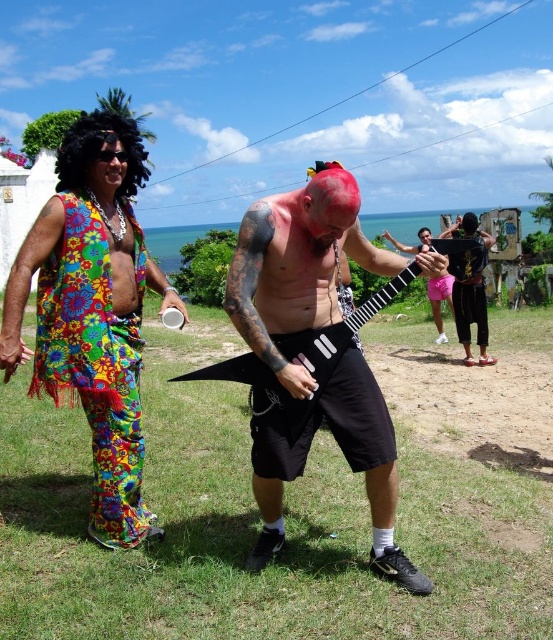
You are a photographer standing in the scene and want to capture a photo where the black leather jacket at lower right is visible above the pink matte guitar at center. Is this possible?

The black leather jacket at lower right is below the pink matte guitar at center, so it cannot be visible above it in the current arrangement.

You are standing in the grassy area near the ocean and see two points in the scene. Which point is closer to you, point (126, 534) or point (463, 253)?

Point (126, 534) is closer to the viewer than point (463, 253).

You are a photographer trying to capture a clear shot of the floral fabric vest at left and the black leather jacket at lower right. Which object will appear closer to the camera in the photo?

The floral fabric vest at left will appear closer to the camera because it is in front of the black leather jacket at lower right.